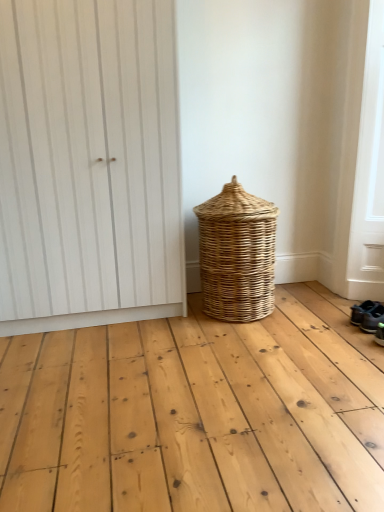
Where is `white wood door at upper left`? This screenshot has width=384, height=512. white wood door at upper left is located at coordinates (89, 164).

The image size is (384, 512). Describe the element at coordinates (237, 254) in the screenshot. I see `woven natural basket at center` at that location.

The image size is (384, 512). What do you see at coordinates (369, 173) in the screenshot?
I see `white textured screen door at lower right` at bounding box center [369, 173].

At what (x,y) coordinates should I click in order to perform the action: click on white wood door at upper left. Please return your answer as a coordinate pair (x, y). Image resolution: width=384 pixels, height=512 pixels. Looking at the image, I should click on (89, 164).

Based on the photo, can you confirm if white textured screen door at lower right is shorter than dark gray fabric shoe at lower right, marked as the second footwear in a back-to-front arrangement?

No, white textured screen door at lower right is not shorter than dark gray fabric shoe at lower right, marked as the second footwear in a back-to-front arrangement.

Between white textured screen door at lower right and dark gray fabric shoe at lower right, marked as the second footwear in a back-to-front arrangement, which one appears on the left side from the viewer's perspective?

white textured screen door at lower right.

Does point (376, 77) appear closer or farther from the camera than point (383, 318)?

Point (376, 77) appears to be farther away from the viewer than point (383, 318).

Considering the relative positions of white textured screen door at lower right and dark gray fabric shoe at lower right, the first footwear from the front, in the image provided, is white textured screen door at lower right in front of dark gray fabric shoe at lower right, the first footwear from the front,?

Yes.

Is white textured screen door at lower right looking in the opposite direction of dark blue fabric sneakers at lower right, the 2th footwear when ordered from front to back?

Yes, dark blue fabric sneakers at lower right, the 2th footwear when ordered from front to back, is at the back of white textured screen door at lower right.

How far apart are white textured screen door at lower right and dark blue fabric sneakers at lower right, acting as the 1th footwear starting from the back?

white textured screen door at lower right and dark blue fabric sneakers at lower right, acting as the 1th footwear starting from the back, are 25.24 inches apart from each other.

Which point is more forward, (352, 268) or (360, 323)?

The point (360, 323) is closer.

Can you tell me how much white textured screen door at lower right and dark blue fabric sneakers at lower right, the 2th footwear when ordered from front to back, differ in facing direction?

white textured screen door at lower right and dark blue fabric sneakers at lower right, the 2th footwear when ordered from front to back, are facing 4.93 degrees away from each other.

Is dark blue fabric sneakers at lower right, the 2th footwear when ordered from front to back, completely or partially inside white wood door at upper left?

No, dark blue fabric sneakers at lower right, the 2th footwear when ordered from front to back, is not inside white wood door at upper left.

Is white wood door at upper left bigger than dark blue fabric sneakers at lower right, the 2th footwear when ordered from front to back?

Correct, white wood door at upper left is larger in size than dark blue fabric sneakers at lower right, the 2th footwear when ordered from front to back.

From a real-world perspective, is white wood door at upper left beneath dark blue fabric sneakers at lower right, acting as the 1th footwear starting from the back?

Actually, white wood door at upper left is physically above dark blue fabric sneakers at lower right, acting as the 1th footwear starting from the back, in the real world.

Is white wood door at upper left facing away from dark blue fabric sneakers at lower right, acting as the 1th footwear starting from the back?

No, white wood door at upper left is not facing away from dark blue fabric sneakers at lower right, acting as the 1th footwear starting from the back.

Between white textured screen door at lower right and woven natural basket at center, which one is positioned behind?

woven natural basket at center is behind.

How different are the orientations of white textured screen door at lower right and woven natural basket at center in degrees?

white textured screen door at lower right and woven natural basket at center are facing 89.3 degrees away from each other.

Is woven natural basket at center surrounded by white textured screen door at lower right?

No, woven natural basket at center is not surrounded by white textured screen door at lower right.

Is white textured screen door at lower right at the left side of woven natural basket at center?

In fact, white textured screen door at lower right is to the right of woven natural basket at center.

Which of these two, white wood door at upper left or woven natural basket at center, stands shorter?

With less height is woven natural basket at center.

Considering their positions, is white wood door at upper left located in front of or behind woven natural basket at center?

Clearly, white wood door at upper left is in front of woven natural basket at center.

From the picture: Considering the sizes of objects white wood door at upper left and woven natural basket at center in the image provided, who is smaller, white wood door at upper left or woven natural basket at center?

woven natural basket at center is smaller.

From a real-world perspective, relative to woven natural basket at center, is white wood door at upper left vertically above or below?

white wood door at upper left is situated higher than woven natural basket at center in the real world.

From a real-world perspective, who is located lower, white wood door at upper left or dark gray fabric shoe at lower right, the first footwear from the front?

In real-world perspective, dark gray fabric shoe at lower right, the first footwear from the front, is lower.

In the image, is white wood door at upper left positioned in front of or behind dark gray fabric shoe at lower right, the first footwear from the front?

In the image, white wood door at upper left appears in front of dark gray fabric shoe at lower right, the first footwear from the front.

Would you consider white wood door at upper left to be distant from dark gray fabric shoe at lower right, the first footwear from the front?

white wood door at upper left is far away from dark gray fabric shoe at lower right, the first footwear from the front.

Between white wood door at upper left and dark gray fabric shoe at lower right, marked as the second footwear in a back-to-front arrangement, which one appears on the right side from the viewer's perspective?

Positioned to the right is dark gray fabric shoe at lower right, marked as the second footwear in a back-to-front arrangement.

Which is more to the right, woven natural basket at center or white wood door at upper left?

woven natural basket at center is more to the right.

From the image's perspective, relative to white wood door at upper left, is woven natural basket at center above or below?

woven natural basket at center is situated lower than white wood door at upper left in the image.

How much distance is there between woven natural basket at center and white wood door at upper left?

The distance of woven natural basket at center from white wood door at upper left is 55.23 centimeters.

At what (x,y) coordinates should I click in order to perform the action: click on screen door in front of the dark gray fabric shoe at lower right, marked as the second footwear in a back-to-front arrangement. Please return your answer as a coordinate pair (x, y). The image size is (384, 512). Looking at the image, I should click on (369, 173).

Find the location of a particular element. Image resolution: width=384 pixels, height=512 pixels. the 1st footwear to the right of the white textured screen door at lower right, counting from the anchor's position is located at coordinates (362, 311).

Based on the photo, which object lies further to the anchor point white wood door at upper left, woven natural basket at center or dark blue fabric sneakers at lower right, acting as the 1th footwear starting from the back?

dark blue fabric sneakers at lower right, acting as the 1th footwear starting from the back, is further to white wood door at upper left.

When comparing their distances from dark gray fabric shoe at lower right, the first footwear from the front, does white wood door at upper left or white textured screen door at lower right seem closer?

white textured screen door at lower right is positioned closer to the anchor dark gray fabric shoe at lower right, the first footwear from the front.

Looking at this image, based on their spatial positions, is white textured screen door at lower right or dark blue fabric sneakers at lower right, the 2th footwear when ordered from front to back, further from dark gray fabric shoe at lower right, the first footwear from the front?

The object further to dark gray fabric shoe at lower right, the first footwear from the front, is white textured screen door at lower right.

Based on their spatial positions, is dark blue fabric sneakers at lower right, acting as the 1th footwear starting from the back, or white wood door at upper left closer to dark gray fabric shoe at lower right, marked as the second footwear in a back-to-front arrangement?

The object closer to dark gray fabric shoe at lower right, marked as the second footwear in a back-to-front arrangement, is dark blue fabric sneakers at lower right, acting as the 1th footwear starting from the back.

When comparing their distances from dark blue fabric sneakers at lower right, the 2th footwear when ordered from front to back, does woven natural basket at center or dark gray fabric shoe at lower right, marked as the second footwear in a back-to-front arrangement, seem closer?

dark gray fabric shoe at lower right, marked as the second footwear in a back-to-front arrangement.

Based on their spatial positions, is dark gray fabric shoe at lower right, marked as the second footwear in a back-to-front arrangement, or woven natural basket at center further from white wood door at upper left?

dark gray fabric shoe at lower right, marked as the second footwear in a back-to-front arrangement.

Estimate the real-world distances between objects in this image. Which object is closer to white textured screen door at lower right, dark gray fabric shoe at lower right, the first footwear from the front, or dark blue fabric sneakers at lower right, acting as the 1th footwear starting from the back?

Based on the image, dark blue fabric sneakers at lower right, acting as the 1th footwear starting from the back, appears to be nearer to white textured screen door at lower right.

Based on their spatial positions, is dark blue fabric sneakers at lower right, the 2th footwear when ordered from front to back, or woven natural basket at center further from dark gray fabric shoe at lower right, marked as the second footwear in a back-to-front arrangement?

woven natural basket at center is further to dark gray fabric shoe at lower right, marked as the second footwear in a back-to-front arrangement.

This screenshot has width=384, height=512. Find the location of `basket between white wood door at upper left and dark gray fabric shoe at lower right, the first footwear from the front, in the horizontal direction`. basket between white wood door at upper left and dark gray fabric shoe at lower right, the first footwear from the front, in the horizontal direction is located at coordinates (237, 254).

Where is `screen door between woven natural basket at center and dark gray fabric shoe at lower right, the first footwear from the front, from left to right`? The width and height of the screenshot is (384, 512). screen door between woven natural basket at center and dark gray fabric shoe at lower right, the first footwear from the front, from left to right is located at coordinates click(369, 173).

Identify the location of basket located between white wood door at upper left and white textured screen door at lower right in the left-right direction. This screenshot has width=384, height=512. (237, 254).

Where is `screen door located between woven natural basket at center and dark blue fabric sneakers at lower right, acting as the 1th footwear starting from the back, in the left-right direction`? screen door located between woven natural basket at center and dark blue fabric sneakers at lower right, acting as the 1th footwear starting from the back, in the left-right direction is located at coordinates (369, 173).